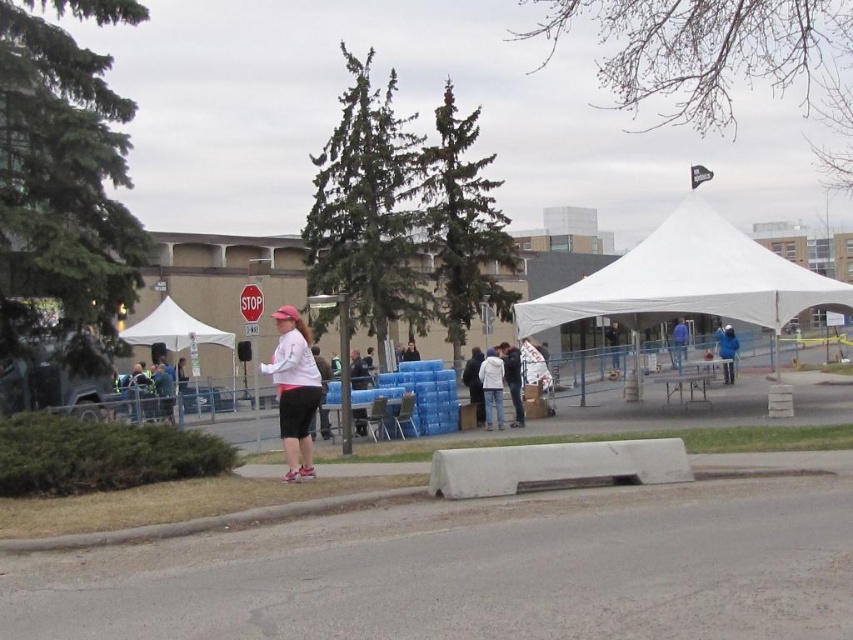
Question: Which is farther from the white fabric canopy at center?

Choices:
 (A) white plastic bag at center
 (B) blue matte jacket at center
 (C) matte pink shirt at center
 (D) blue fabric tent at center

Answer: (A)

Question: Is the position of white matte jacket at center less distant than that of blue fabric tent at center?

Choices:
 (A) yes
 (B) no

Answer: (A)

Question: Is white cotton jacket at center wider than blue matte jacket at center?

Choices:
 (A) yes
 (B) no

Answer: (B)

Question: Among these points, which one is farthest from the camera?

Choices:
 (A) (682, 333)
 (B) (494, 364)
 (C) (515, 404)

Answer: (A)

Question: Among these objects, which one is farthest from the camera?

Choices:
 (A) blue fabric tent at center
 (B) white matte jacket at center
 (C) white plastic bag at center
 (D) white cotton jacket at center

Answer: (A)

Question: Does white fabric canopy at center appear on the right side of blue fabric tent at center?

Choices:
 (A) no
 (B) yes

Answer: (A)